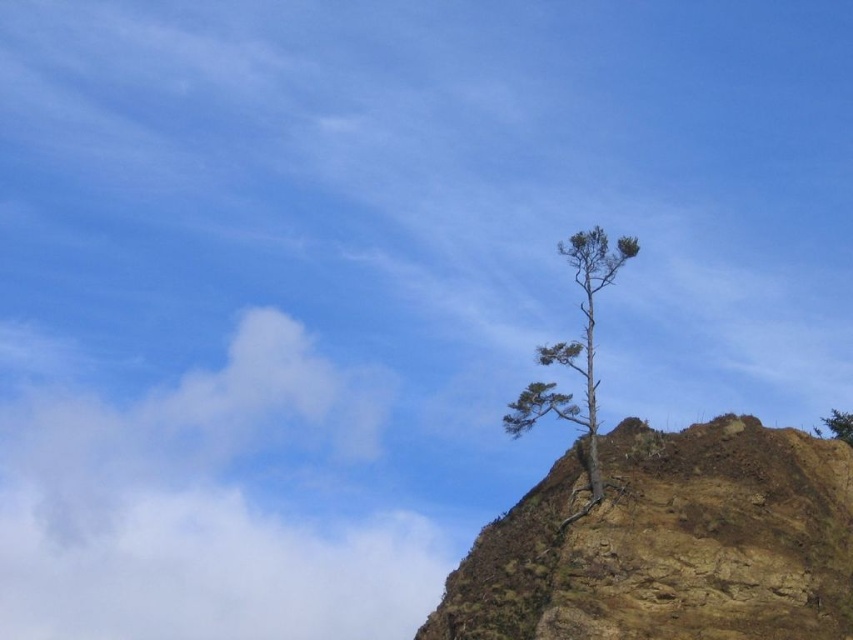
Question: Is green textured tree at upper right further to camera compared to green leafy tree at upper right?

Choices:
 (A) no
 (B) yes

Answer: (A)

Question: Which of the following is the closest to the observer?

Choices:
 (A) (780, 486)
 (B) (840, 413)

Answer: (A)

Question: Which point is farther to the camera?

Choices:
 (A) (564, 342)
 (B) (657, 508)

Answer: (A)

Question: Which point appears closest to the camera in this image?

Choices:
 (A) (585, 625)
 (B) (573, 252)

Answer: (A)

Question: Does brown rocky cliff at upper right appear on the left side of green leafy tree at upper right?

Choices:
 (A) no
 (B) yes

Answer: (B)

Question: Does brown rocky cliff at upper right have a larger size compared to green leafy tree at upper right?

Choices:
 (A) no
 (B) yes

Answer: (B)